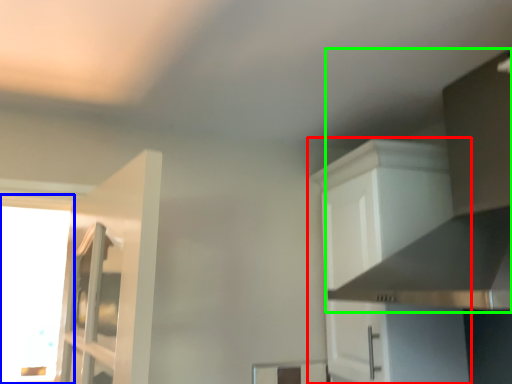
Question: Estimate the real-world distances between objects in this image. Which object is farther from cabinetry (highlighted by a red box), window (highlighted by a blue box) or vent (highlighted by a green box)?

Choices:
 (A) window
 (B) vent

Answer: (A)